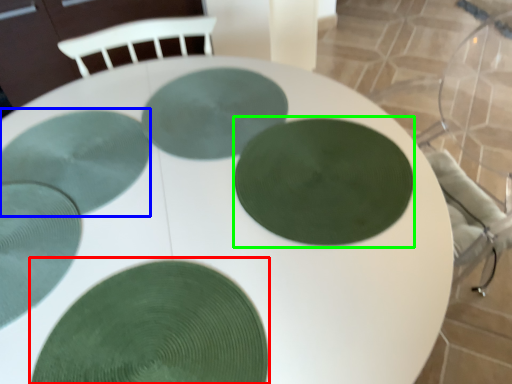
Question: Considering the real-world distances, which object is closest to glass plate (highlighted by a red box)? glass plate (highlighted by a blue box) or glass plate (highlighted by a green box).

Choices:
 (A) glass plate
 (B) glass plate

Answer: (B)